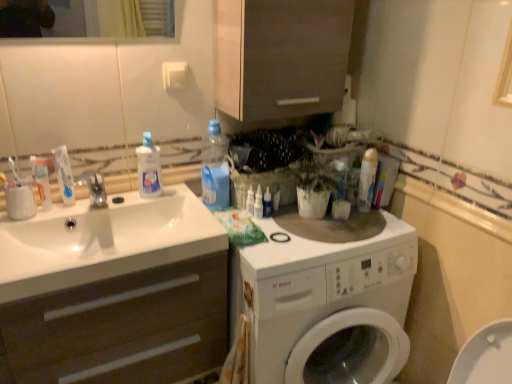
You are a GUI agent. You are given a task and a screenshot of the screen. Output one action in this format:
    pyautogui.click(x=<x>, y=<y>)
    Task: Click on the vacant area that lies to the right of white glossy bottle at center, the 1th toiletry in the left-to-right sequence
    The width and height of the screenshot is (512, 384).
    Given the screenshot: What is the action you would take?
    pyautogui.click(x=302, y=226)